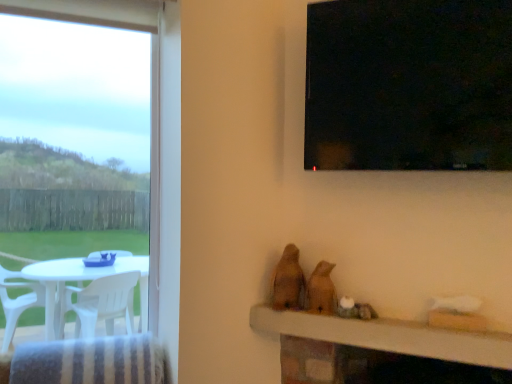
Question: From a real-world perspective, is brown matte bird at center, the 2th animal when ordered from left to right, physically above brown matte bird at center, the 1th animal viewed from the left?

Choices:
 (A) no
 (B) yes

Answer: (A)

Question: Is brown matte bird at center, the 2th animal when ordered from left to right, positioned far away from brown matte bird at center, the 1th animal viewed from the left?

Choices:
 (A) yes
 (B) no

Answer: (B)

Question: Considering the relative positions of brown matte bird at center, the first animal from the right, and brown matte bird at center, the 1th animal viewed from the left, in the image provided, is brown matte bird at center, the first animal from the right, to the left of brown matte bird at center, the 1th animal viewed from the left, from the viewer's perspective?

Choices:
 (A) no
 (B) yes

Answer: (A)

Question: Is the depth of brown matte bird at center, the 2th animal when ordered from left to right, greater than that of brown matte bird at center, the 1th animal viewed from the left?

Choices:
 (A) yes
 (B) no

Answer: (B)

Question: Is brown matte bird at center, the first animal from the right, shorter than brown matte bird at center, the 1th animal viewed from the left?

Choices:
 (A) no
 (B) yes

Answer: (B)

Question: Considering the positions of brown matte bird at center, the 1th animal viewed from the left, and transparent glass window at upper right in the image, is brown matte bird at center, the 1th animal viewed from the left, bigger or smaller than transparent glass window at upper right?

Choices:
 (A) big
 (B) small

Answer: (B)

Question: Considering the positions of point (295, 296) and point (345, 64), is point (295, 296) closer or farther from the camera than point (345, 64)?

Choices:
 (A) farther
 (B) closer

Answer: (A)

Question: From the image's perspective, is brown matte bird at center, the 1th animal viewed from the left, positioned above or below transparent glass window at upper right?

Choices:
 (A) above
 (B) below

Answer: (B)

Question: In terms of height, does brown matte bird at center, the 1th animal viewed from the left, look taller or shorter compared to transparent glass window at upper right?

Choices:
 (A) tall
 (B) short

Answer: (B)

Question: From the image's perspective, is transparent glass window at upper right above or below brown matte bird at center, the 2th animal when ordered from left to right?

Choices:
 (A) above
 (B) below

Answer: (A)

Question: Is transparent glass window at upper right to the left or to the right of brown matte bird at center, the 2th animal when ordered from left to right, in the image?

Choices:
 (A) left
 (B) right

Answer: (B)

Question: Based on their sizes in the image, would you say transparent glass window at upper right is bigger or smaller than brown matte bird at center, the 2th animal when ordered from left to right?

Choices:
 (A) small
 (B) big

Answer: (B)

Question: Considering their positions, is transparent glass window at upper right located in front of or behind brown matte bird at center, the 2th animal when ordered from left to right?

Choices:
 (A) front
 (B) behind

Answer: (A)

Question: Visually, is wooden table at lower center positioned to the left or to the right of transparent glass window at upper right?

Choices:
 (A) left
 (B) right

Answer: (A)

Question: From their relative heights in the image, would you say wooden table at lower center is taller or shorter than transparent glass window at upper right?

Choices:
 (A) tall
 (B) short

Answer: (B)